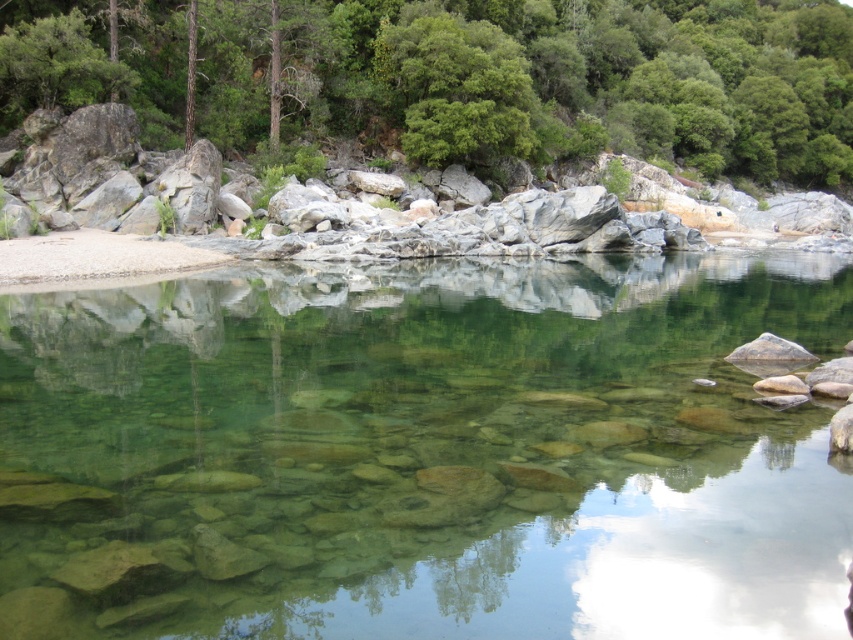
Consider the image. Does clear glassy water at center appear under green leafy tree at upper center?

Correct, clear glassy water at center is located below green leafy tree at upper center.

Between point (409, 385) and point (257, 147), which one is positioned behind?

The point (257, 147) is more distant.

Identify the location of clear glassy water at center. The image size is (853, 640). (422, 452).

The image size is (853, 640). I want to click on clear glassy water at center, so click(422, 452).